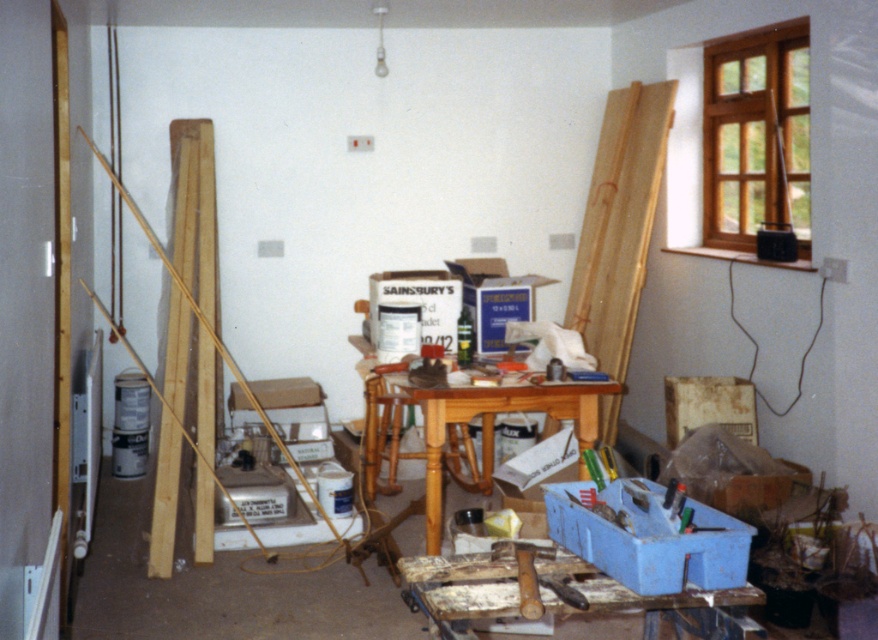
Describe the element at coordinates (619, 221) in the screenshot. This screenshot has width=878, height=640. I see `light brown wooden ladder at center` at that location.

Does light brown wooden ladder at center come behind wooden table at center?

Yes, it is behind wooden table at center.

Which is behind, point (591, 234) or point (402, 365)?

The point (591, 234) is more distant.

Where is `light brown wooden ladder at center`? Image resolution: width=878 pixels, height=640 pixels. light brown wooden ladder at center is located at coordinates (619, 221).